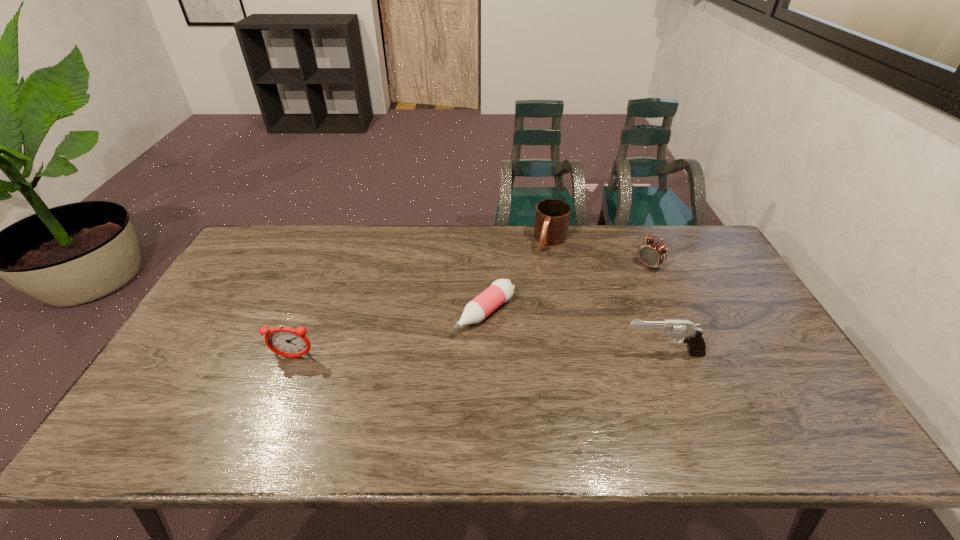
Where is `vacant space on the desktop that is between the left alarm clock and the gun and is positioned with the cap open on the second object from left to right`? This screenshot has height=540, width=960. vacant space on the desktop that is between the left alarm clock and the gun and is positioned with the cap open on the second object from left to right is located at coordinates (433, 356).

Find the location of a particular element. The width and height of the screenshot is (960, 540). free space on the desktop that is between the left alarm clock and the gun and is positioned on the side of the mug with the handle is located at coordinates (494, 355).

Image resolution: width=960 pixels, height=540 pixels. In order to click on vacant spot on the desktop that is between the leftmost object and the gun and is positioned on the face of the farther alarm clock in this screenshot , I will do `click(530, 354)`.